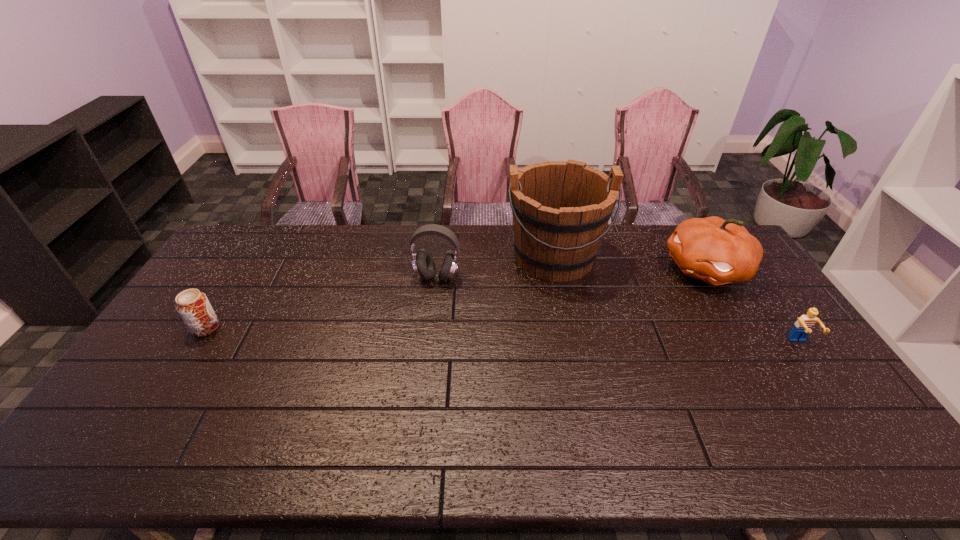
Locate an element on the screen. This screenshot has height=540, width=960. vacant space situated on the side of the wine bucket with the handle for carrying is located at coordinates (568, 340).

Find the location of a particular element. The image size is (960, 540). free space located 0.100m on the front face of the pumpkin is located at coordinates (656, 294).

Find the location of `vacant space located on the front face of the pumpkin`. vacant space located on the front face of the pumpkin is located at coordinates (608, 318).

Where is `free point located on the front face of the pumpkin`? free point located on the front face of the pumpkin is located at coordinates (603, 320).

At what (x,y) coordinates should I click in order to perform the action: click on blank space located 0.130m on the ear cups of the second object from left to right. Please return your answer as a coordinate pair (x, y). The image size is (960, 540). Looking at the image, I should click on (420, 315).

The height and width of the screenshot is (540, 960). Find the location of `vacant space located 0.290m on the ear cups of the second object from left to right`. vacant space located 0.290m on the ear cups of the second object from left to right is located at coordinates (403, 355).

Find the location of a particular element. The height and width of the screenshot is (540, 960). blank area located 0.200m on the ear cups of the second object from left to right is located at coordinates (413, 332).

Where is `wine bucket present at the far edge`? wine bucket present at the far edge is located at coordinates (561, 209).

Locate an element on the screen. pumpkin that is positioned at the far edge is located at coordinates (716, 251).

Where is `object located in the left edge section of the desktop`? Image resolution: width=960 pixels, height=540 pixels. object located in the left edge section of the desktop is located at coordinates pyautogui.click(x=192, y=305).